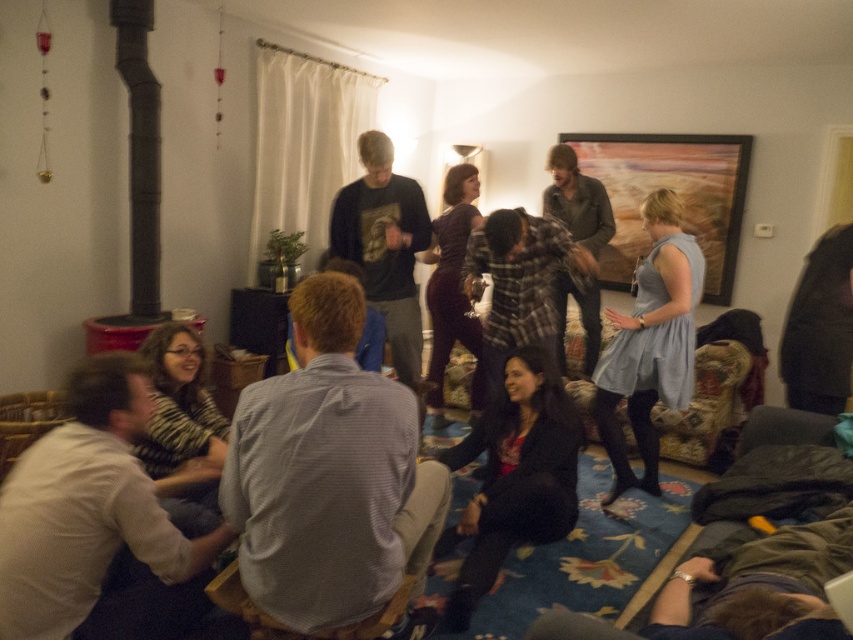
You are organizing a small event in this living room and need to place a large decorative item that requires a space bigger than the black matte pipe at left. Can the light blue fabric dress at center accommodate this item?

The light blue fabric dress at center is larger in size than the black matte pipe at left, so it can accommodate the large decorative item since it has enough space.

You are a photographer standing in the living room and want to take a photo of the light blue fabric dress at center and the black matte pipe at left. You need to ensure that both subjects are in focus. Given that your camera can only focus on objects within a 5 feet range, will you be able to capture both in focus?

The light blue fabric dress at center and the black matte pipe at left are 8.23 feet apart, which exceeds the camera focus range of 5 feet. Therefore, you cannot capture both in focus simultaneously.